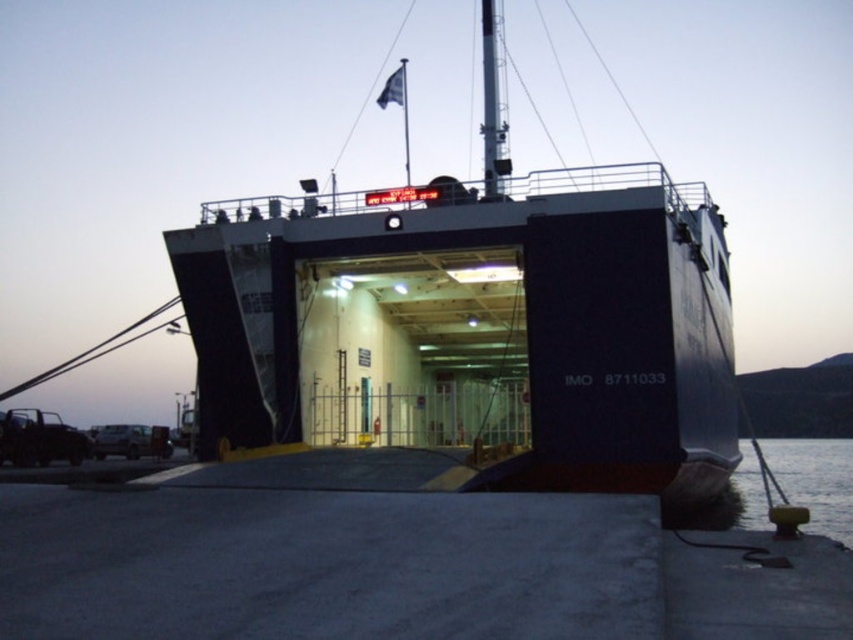
Looking at this image, you are a photographer standing at the dock, and you want to take a photo of the dark blue matte ship at center. The camera you are using has a maximum focus range of 15 meters. Will the ship be in focus?

The dark blue matte ship at center is 13.46 meters from camera, which is within the camera maximum focus range of 15 meters. So the ship will be in focus.

You are standing on the ferry and want to move from the point at coordinates point (538, 272) to the point at coordinates point (741, 515). Which direction should you move relative to the ferry?

You should move towards the back of the ferry because point (538, 272) is in front of point (741, 515), meaning the destination is behind the starting point.

You are a photographer standing on the dock and want to capture both the dark blue matte ship at center and the dark blue water at lower right in a single photo. Which object will appear larger in the photo?

The dark blue matte ship at center will appear larger in the photo because it is closer to the photographer than the dark blue water at lower right.